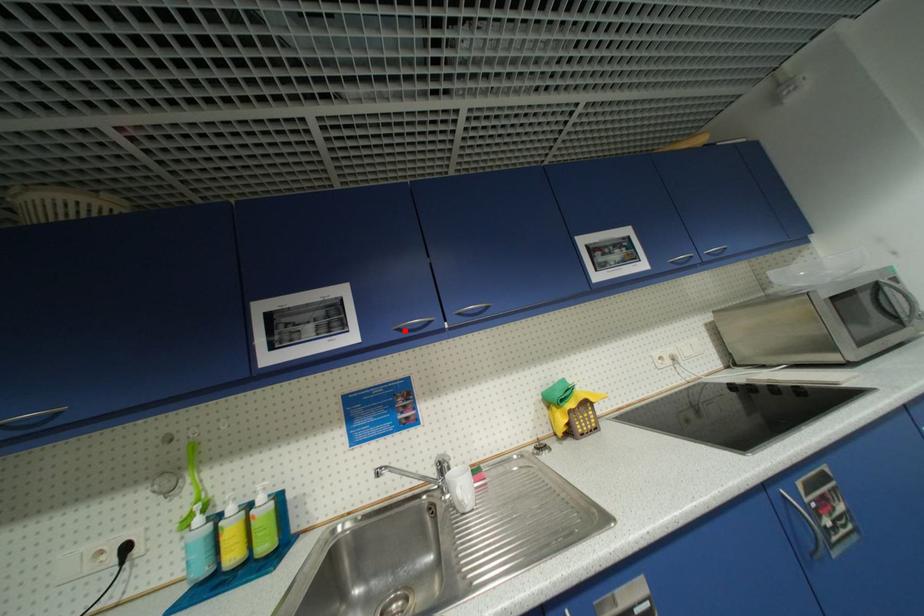
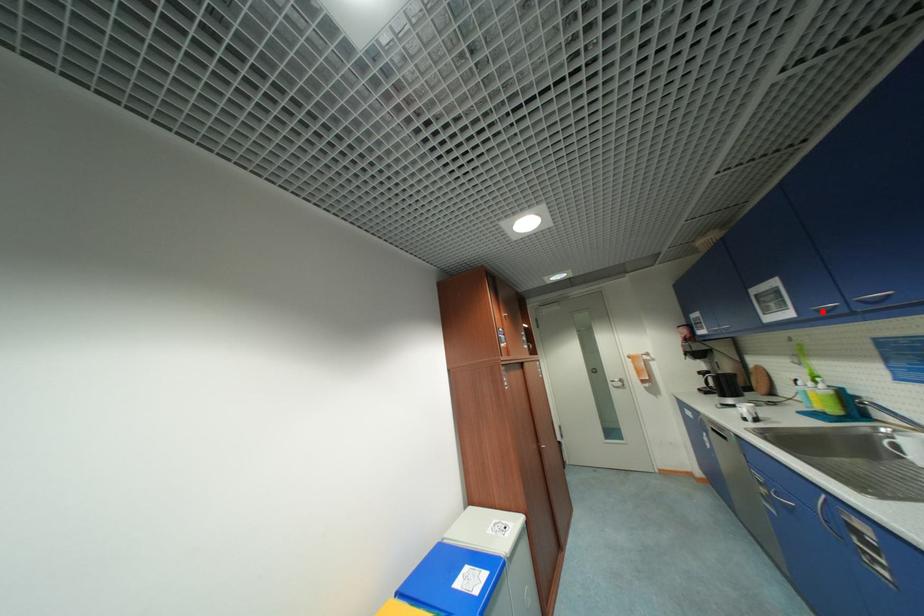
Based on the photo, I am providing you with two images of the same scene from different viewpoints. A red point is marked on the first image and another point is marked on the second image. Is the marked point in image1 the same physical position as the marked point in image2?

Yes